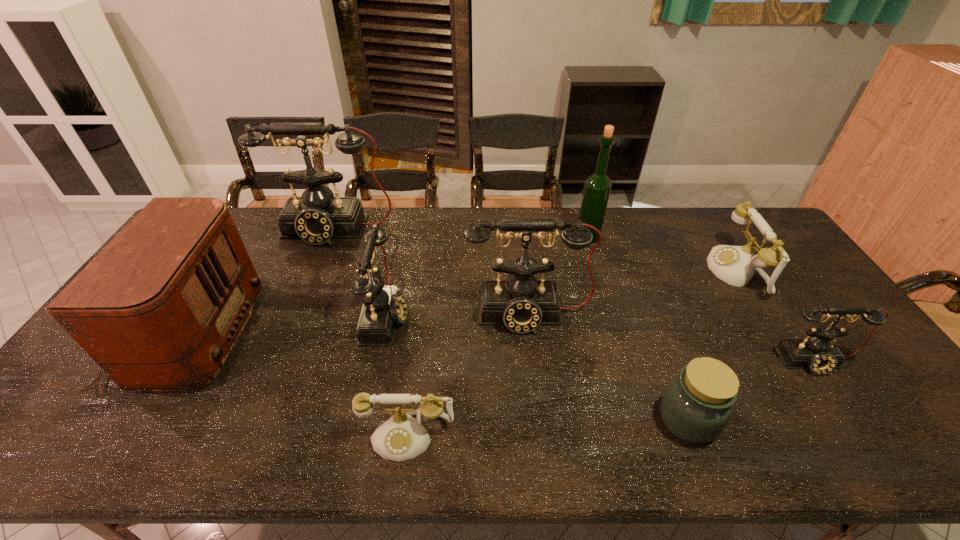
Where is `blank area located 0.070m on the dial of the bigger white telephone`? The image size is (960, 540). blank area located 0.070m on the dial of the bigger white telephone is located at coordinates (688, 272).

You are a GUI agent. You are given a task and a screenshot of the screen. Output one action in this format:
    pyautogui.click(x=<x>, y=<y>)
    Task: Click on the free location located 0.240m on the dial of the bigger white telephone
    Image resolution: width=960 pixels, height=540 pixels.
    Given the screenshot: What is the action you would take?
    pyautogui.click(x=636, y=272)

Where is `vacant space located 0.310m on the dial of the bigger white telephone`? The height and width of the screenshot is (540, 960). vacant space located 0.310m on the dial of the bigger white telephone is located at coordinates (613, 272).

Locate an element on the screen. The height and width of the screenshot is (540, 960). free region located on the back of the green jar is located at coordinates (636, 282).

Locate an element on the screen. The height and width of the screenshot is (540, 960). liquor that is at the far edge is located at coordinates (597, 187).

The height and width of the screenshot is (540, 960). In order to click on jar at the near edge in this screenshot , I will do `click(696, 406)`.

I want to click on telephone situated at the near edge, so click(402, 437).

Locate an element on the screen. object at the left edge is located at coordinates (161, 306).

Identify the location of object located at the far right corner. (735, 265).

In the image, there is a desktop. What are the coordinates of `vacant space at the far edge` in the screenshot? It's located at (722, 235).